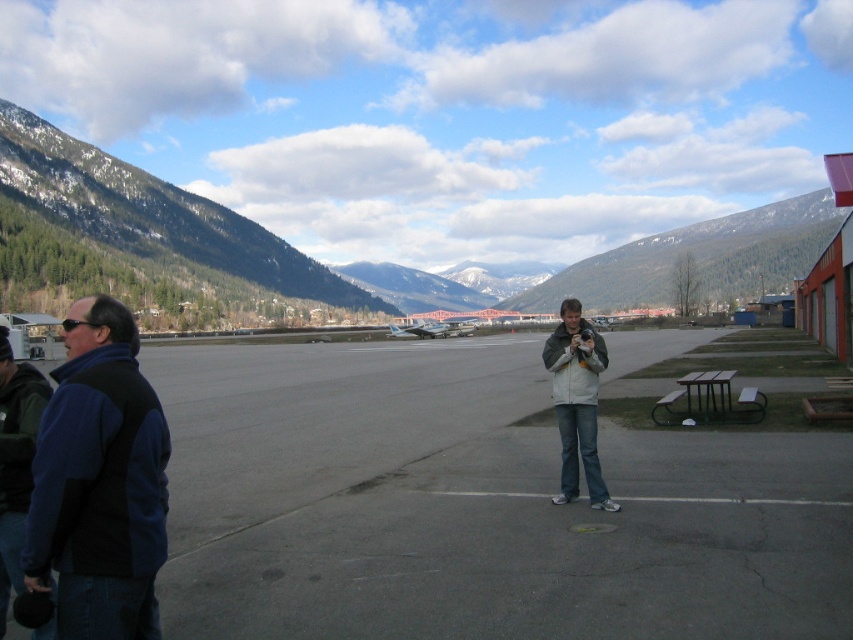
Between snowy forested mountain at center and light gray fleece jacket at center, which one is positioned higher?

snowy forested mountain at center

Does snowy forested mountain at center appear over light gray fleece jacket at center?

Indeed, snowy forested mountain at center is positioned over light gray fleece jacket at center.

Is point (589, 301) behind point (579, 321)?

That is True.

At what (x,y) coordinates should I click in order to perform the action: click on snowy forested mountain at center. Please return your answer as a coordinate pair (x, y). The height and width of the screenshot is (640, 853). Looking at the image, I should click on [697, 259].

In the scene shown: Does blue fleece vest at left have a greater height compared to light gray fleece jacket at center?

Incorrect, blue fleece vest at left's height is not larger of light gray fleece jacket at center's.

What do you see at coordinates (99, 483) in the screenshot? The width and height of the screenshot is (853, 640). I see `blue fleece vest at left` at bounding box center [99, 483].

Image resolution: width=853 pixels, height=640 pixels. In order to click on blue fleece vest at left in this screenshot , I will do `click(99, 483)`.

Does gray asphalt tarmac at center have a larger size compared to green forested mountain at left?

Incorrect, gray asphalt tarmac at center is not larger than green forested mountain at left.

Does point (218, 545) come in front of point (209, 221)?

Yes, point (218, 545) is in front of point (209, 221).

Is point (398, 342) positioned before point (85, 147)?

That is True.

Find the location of a particular element. This screenshot has width=853, height=640. gray asphalt tarmac at center is located at coordinates (476, 506).